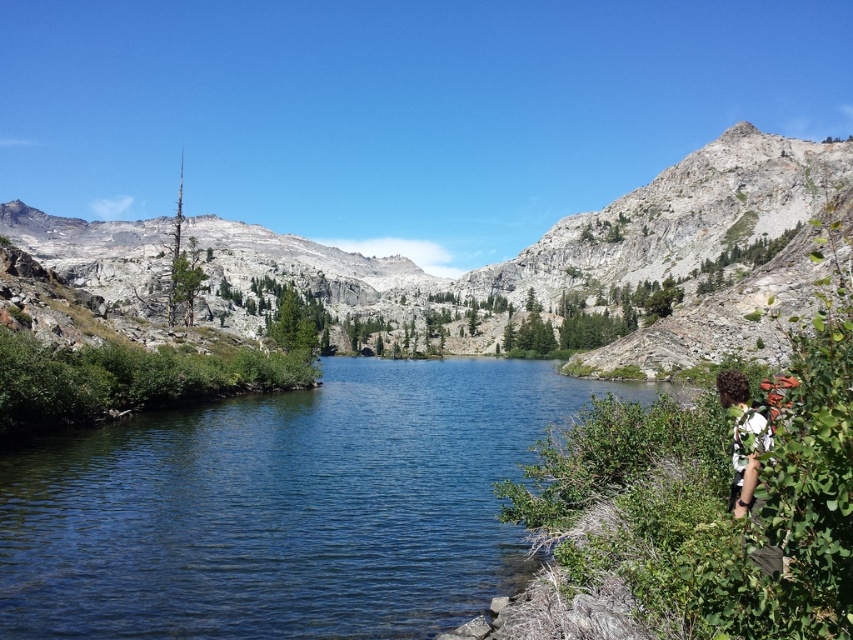
Question: Which object is farther from the camera taking this photo?

Choices:
 (A) clear water at center
 (B) gray rocky mountain at center

Answer: (B)

Question: Is clear water at center closer to camera compared to curly hair at lower right?

Choices:
 (A) yes
 (B) no

Answer: (B)

Question: Which object is closer to the camera taking this photo?

Choices:
 (A) gray rocky mountain at center
 (B) curly hair at lower right

Answer: (B)

Question: Can you confirm if clear water at center is positioned to the right of gray rocky mountain at center?

Choices:
 (A) yes
 (B) no

Answer: (A)

Question: Can you confirm if clear water at center is positioned above gray rocky mountain at center?

Choices:
 (A) no
 (B) yes

Answer: (A)

Question: Which point appears farthest from the camera in this image?

Choices:
 (A) (256, 554)
 (B) (621, 272)
 (C) (740, 460)

Answer: (B)